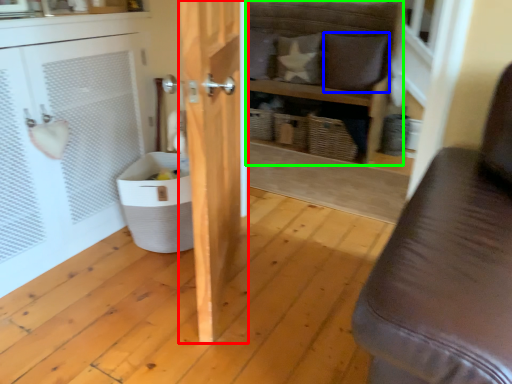
Question: Based on their relative distances, which object is farther from door (highlighted by a red box)? Choose from pillow (highlighted by a blue box) and shelf (highlighted by a green box).

Choices:
 (A) pillow
 (B) shelf

Answer: (A)